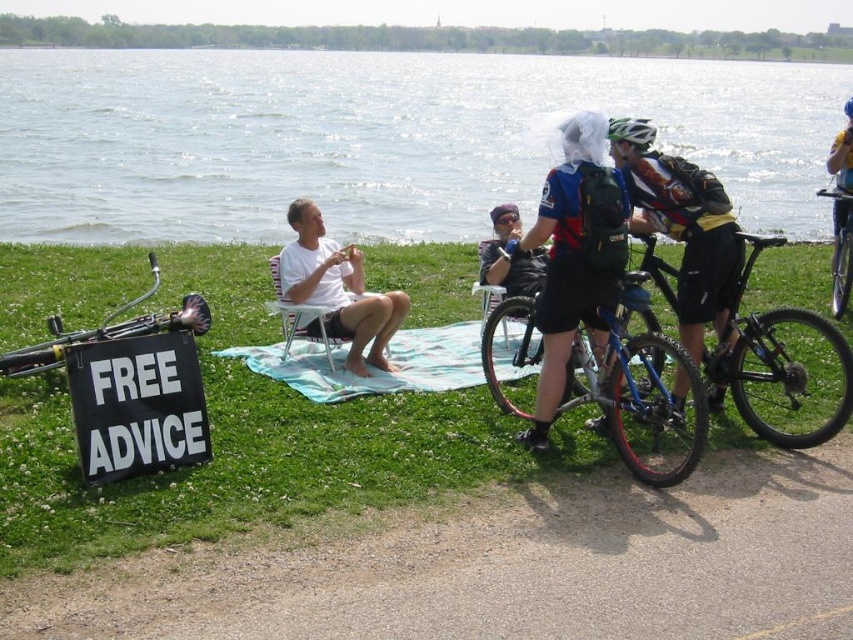
You are planning to take a photo from above the picnic blanket at center. Which object, the white matte shirt at center or the shiny silver bicycle at right, will appear closer to the bottom of your photo?

The white matte shirt at center will appear closer to the bottom of the photo because it is located below the shiny silver bicycle at right.

Based on the photo, you are planning to take a photo of the scene. The white matte shirt at center and the shiny silver bicycle at right are both in the frame. Which object should you focus on first if you want to capture both clearly in the same shot?

The white matte shirt at center has a larger size compared to the shiny silver bicycle at right, so focusing on the larger object, the white matte shirt at center, will help ensure both are in focus.